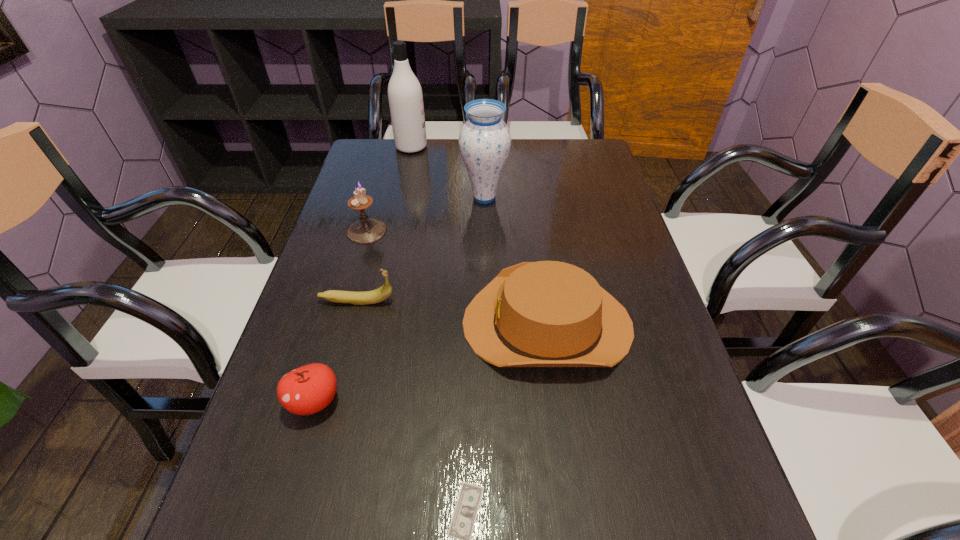
The image size is (960, 540). Find the location of `vacant space that's between the banana and the third farthest object`. vacant space that's between the banana and the third farthest object is located at coordinates (362, 266).

Locate an element on the screen. The height and width of the screenshot is (540, 960). free spot between the banana and the sixth nearest object is located at coordinates click(420, 249).

The width and height of the screenshot is (960, 540). What are the coordinates of `vacant region between the fifth nearest object and the sixth nearest object` in the screenshot? It's located at (425, 214).

What are the coordinates of `vacant area that lies between the second tallest object and the farthest object` in the screenshot? It's located at pyautogui.click(x=448, y=172).

Where is `unoccupied position between the apple and the tallest object`? The height and width of the screenshot is (540, 960). unoccupied position between the apple and the tallest object is located at coordinates (363, 274).

This screenshot has height=540, width=960. What are the coordinates of `free space between the banana and the vase` in the screenshot? It's located at (420, 249).

Select which object is the closest to the shampoo. Please provide its 2D coordinates. Your answer should be formatted as a tuple, i.e. [(x, y)], where the tuple contains the x and y coordinates of a point satisfying the conditions above.

[(484, 140)]

Identify which object is the second closest to the shampoo. Please provide its 2D coordinates. Your answer should be formatted as a tuple, i.e. [(x, y)], where the tuple contains the x and y coordinates of a point satisfying the conditions above.

[(366, 230)]

Identify the location of free space that satisfies the following two spatial constraints: 1. on the back side of the second farthest object; 2. on the front-facing side of the shampoo. This screenshot has height=540, width=960. (484, 147).

The height and width of the screenshot is (540, 960). Identify the location of vacant space that satisfies the following two spatial constraints: 1. on the back side of the sixth farthest object; 2. on the right side of the third tallest object. (365, 231).